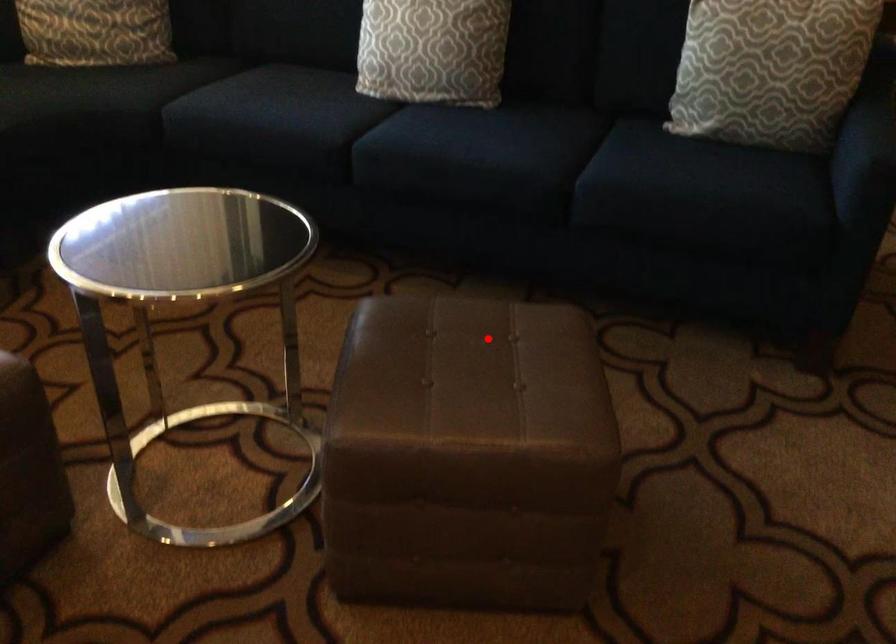
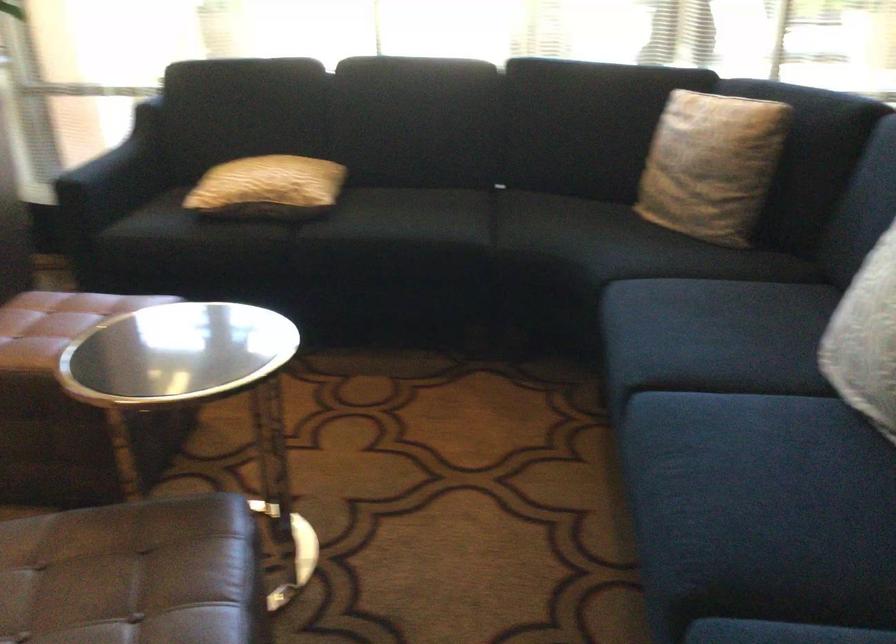
Question: I am providing you with two images of the same scene from different viewpoints. A red point is shown in image1. For the corresponding object point in image2, is it positioned nearer or farther from the camera?

Choices:
 (A) Nearer
 (B) Farther

Answer: (A)